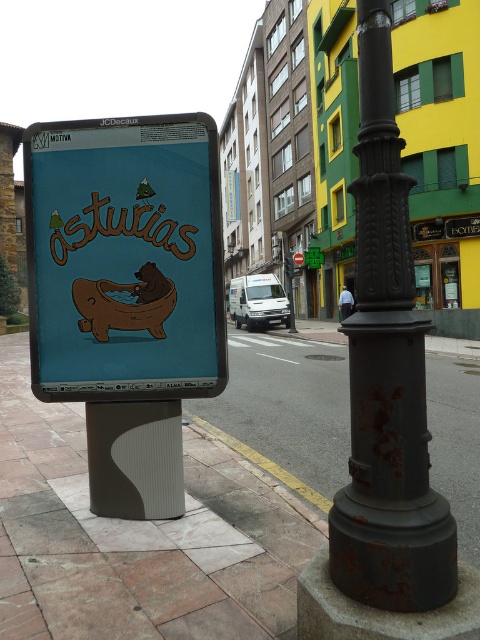
You are a city planner assessing the sidewalk space. The rusty metal pole at lower center and the brown matte hippo at center are both on the sidewalk. Which object has a greater width?

The rusty metal pole at lower center has a greater width than the brown matte hippo at center according to the description.

You are standing on the sidewalk in front of the billboard and see both the brown matte hippo at center and the green plastic sign at center. Which object is closer to your left side?

The brown matte hippo at center is to the left of the green plastic sign at center, so it is closer to your left side.

You are standing on the sidewalk in front of the billboard. Where is the brown matte hippo at center located relative to the billboard?

The brown matte hippo at center is located at point 0.475 on the x axis and 0.260 on the y axis relative to the billboard.